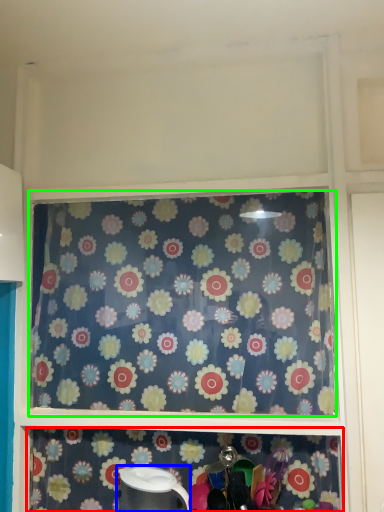
Question: Which is nearer to the shelf (highlighted by a red box)? appliance (highlighted by a blue box) or curtain (highlighted by a green box).

Choices:
 (A) appliance
 (B) curtain

Answer: (A)